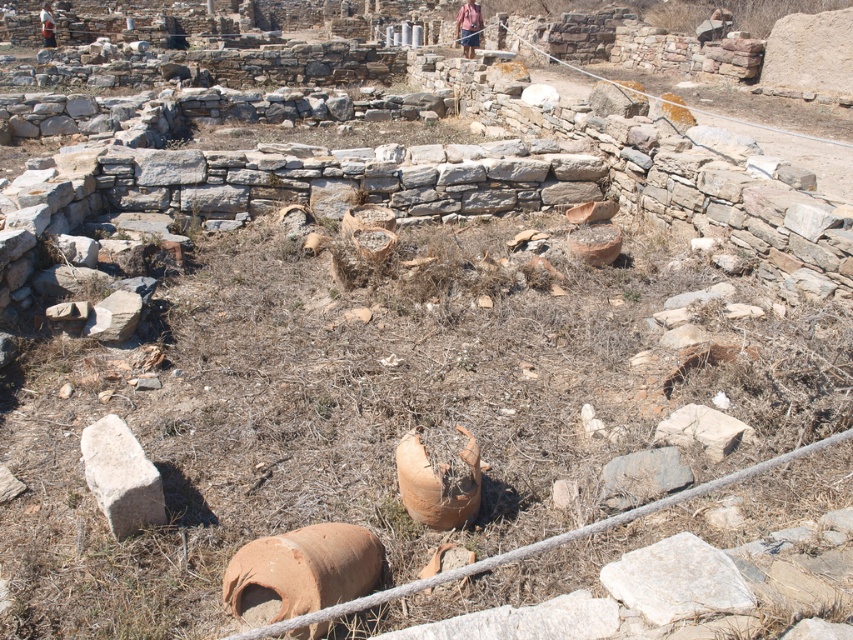
Question: Can you confirm if white rough stone at lower left is positioned to the right of brown leather bag at upper center?

Choices:
 (A) yes
 (B) no

Answer: (B)

Question: Among these objects, which one is farthest from the camera?

Choices:
 (A) camouflage fabric shirt at upper left
 (B) white rough stone at center
 (C) white rough stone at lower left
 (D) brown leather bag at upper center

Answer: (A)

Question: Among these points, which one is farthest from the camera?

Choices:
 (A) (643, 604)
 (B) (160, 509)
 (C) (473, 51)
 (D) (51, 29)

Answer: (D)

Question: Does white rough stone at lower left appear over camouflage fabric shirt at upper left?

Choices:
 (A) yes
 (B) no

Answer: (B)

Question: Estimate the real-world distances between objects in this image. Which object is closer to the brown leather bag at upper center?

Choices:
 (A) white rough stone at lower left
 (B) white rough stone at center

Answer: (A)

Question: Is white rough stone at lower left smaller than camouflage fabric shirt at upper left?

Choices:
 (A) no
 (B) yes

Answer: (B)